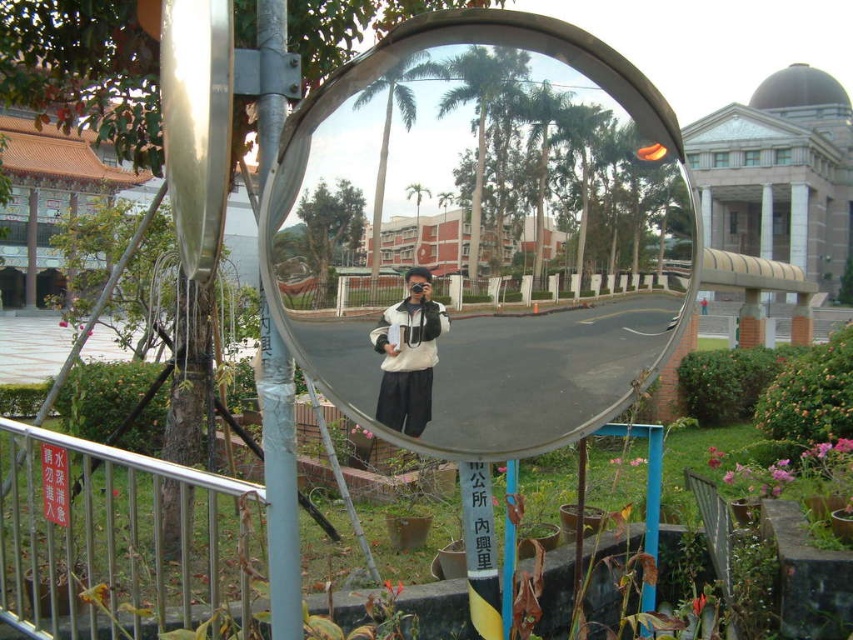
Question: Which point is farther to the camera?

Choices:
 (A) (590, 124)
 (B) (440, 326)

Answer: (A)

Question: Is clear glass mirror at center in front of white matte jacket at center?

Choices:
 (A) no
 (B) yes

Answer: (B)

Question: Is clear glass mirror at center further to the viewer compared to white matte jacket at center?

Choices:
 (A) yes
 (B) no

Answer: (B)

Question: Does clear glass mirror at center have a greater width compared to white matte jacket at center?

Choices:
 (A) no
 (B) yes

Answer: (B)